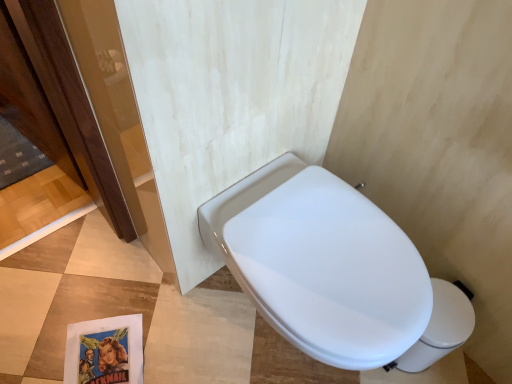
Question: Considering the relative positions of white glossy toilet bowl at lower right and white glossy bidet at center in the image provided, is white glossy toilet bowl at lower right to the right of white glossy bidet at center from the viewer's perspective?

Choices:
 (A) yes
 (B) no

Answer: (A)

Question: Is white glossy toilet bowl at lower right shorter than white glossy bidet at center?

Choices:
 (A) no
 (B) yes

Answer: (B)

Question: Can you see white glossy toilet bowl at lower right touching white glossy bidet at center?

Choices:
 (A) yes
 (B) no

Answer: (B)

Question: Is white glossy toilet bowl at lower right turned away from white glossy bidet at center?

Choices:
 (A) no
 (B) yes

Answer: (A)

Question: Considering the relative sizes of white glossy toilet bowl at lower right and white glossy bidet at center in the image provided, is white glossy toilet bowl at lower right smaller than white glossy bidet at center?

Choices:
 (A) no
 (B) yes

Answer: (B)

Question: Is white glossy toilet bowl at lower right far from white glossy bidet at center?

Choices:
 (A) no
 (B) yes

Answer: (A)

Question: Is white glossy bidet at center positioned behind white glossy toilet bowl at lower right?

Choices:
 (A) no
 (B) yes

Answer: (A)

Question: Is white glossy bidet at center far away from white glossy toilet bowl at lower right?

Choices:
 (A) no
 (B) yes

Answer: (A)

Question: Is white glossy bidet at center bigger than white glossy toilet bowl at lower right?

Choices:
 (A) no
 (B) yes

Answer: (B)

Question: From a real-world perspective, is white glossy bidet at center positioned over white glossy toilet bowl at lower right based on gravity?

Choices:
 (A) no
 (B) yes

Answer: (B)

Question: Is white glossy bidet at center to the right of white glossy toilet bowl at lower right from the viewer's perspective?

Choices:
 (A) no
 (B) yes

Answer: (A)

Question: Considering the relative positions of white glossy bidet at center and white glossy toilet bowl at lower right in the image provided, is white glossy bidet at center to the left of white glossy toilet bowl at lower right from the viewer's perspective?

Choices:
 (A) yes
 (B) no

Answer: (A)

Question: Looking at their shapes, would you say white glossy bidet at center is wider or thinner than white glossy toilet bowl at lower right?

Choices:
 (A) thin
 (B) wide

Answer: (B)